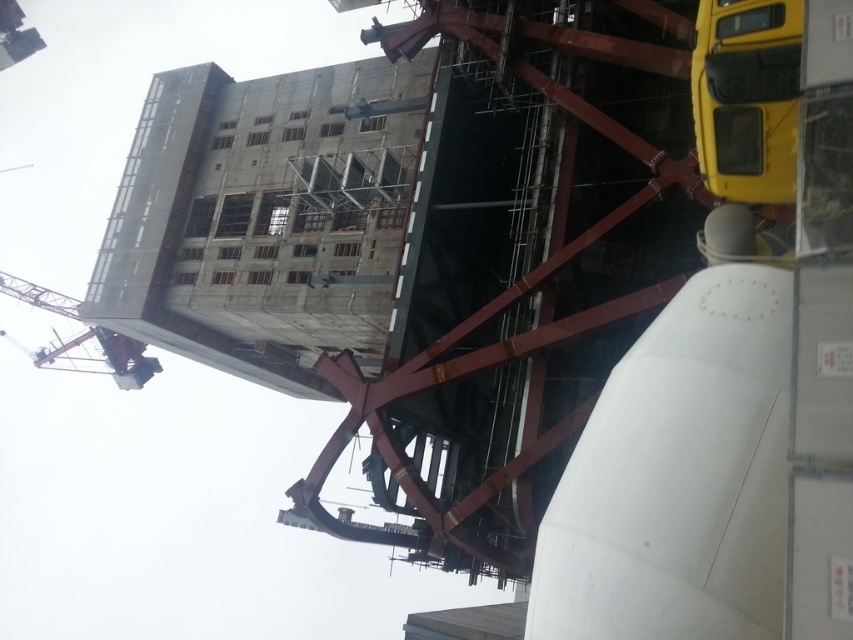
Based on the photo, does yellow matte truck at upper right appear under metallic red crane at upper left?

Incorrect, yellow matte truck at upper right is not positioned below metallic red crane at upper left.

Between yellow matte truck at upper right and metallic red crane at upper left, which one has more height?

Standing taller between the two is metallic red crane at upper left.

Is point (781, 193) closer to camera compared to point (128, 362)?

Yes, it is in front of point (128, 362).

Identify the location of yellow matte truck at upper right. Image resolution: width=853 pixels, height=640 pixels. (747, 97).